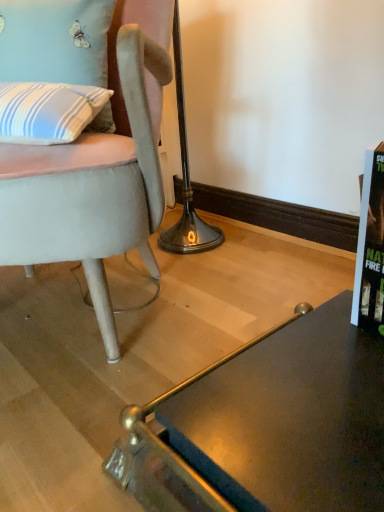
The width and height of the screenshot is (384, 512). I want to click on vacant region to the right of suede-like gray chair at left, so click(x=257, y=282).